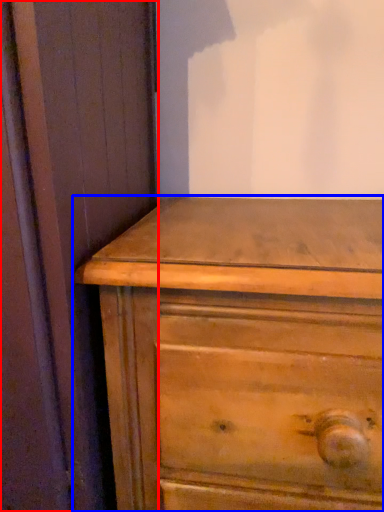
Question: Which of the following is the closest to the observer, screen door (highlighted by a red box) or chest of drawers (highlighted by a blue box)?

Choices:
 (A) screen door
 (B) chest of drawers

Answer: (A)